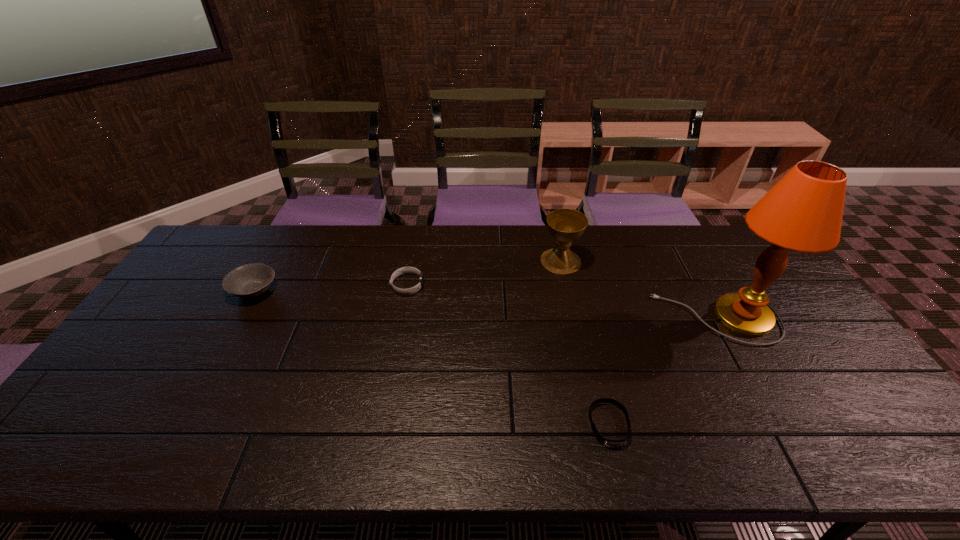
Find the location of a particular element. This screenshot has height=540, width=960. vacant region located on the left of the chalice is located at coordinates (493, 261).

Image resolution: width=960 pixels, height=540 pixels. I want to click on vacant space situated 0.290m on the back of the third tallest object, so click(x=292, y=225).

This screenshot has height=540, width=960. I want to click on free space located 0.080m on the outer surface of the taller wristband, so click(448, 285).

This screenshot has width=960, height=540. I want to click on object positioned at the far edge, so click(x=565, y=225).

What are the coordinates of `object positioned at the near edge` in the screenshot? It's located at pyautogui.click(x=609, y=443).

Locate an element on the screen. This screenshot has width=960, height=540. object that is at the right edge is located at coordinates (803, 212).

In the image, there is a desktop. At what (x,y) coordinates should I click in order to perform the action: click on free space at the far edge. Please return your answer as a coordinate pair (x, y). This screenshot has height=540, width=960. Looking at the image, I should click on (660, 235).

Where is `vacant region at the near edge of the desktop`? The image size is (960, 540). vacant region at the near edge of the desktop is located at coordinates (412, 430).

In the image, there is a desktop. At what (x,y) coordinates should I click in order to perform the action: click on vacant space at the left edge. Please return your answer as a coordinate pair (x, y). This screenshot has width=960, height=540. Looking at the image, I should click on (192, 327).

Locate an element on the screen. This screenshot has width=960, height=540. free region at the right edge of the desktop is located at coordinates (786, 363).